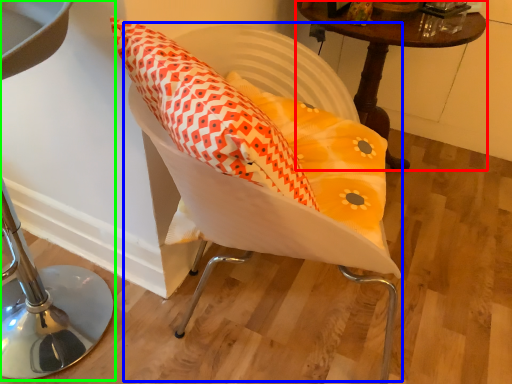
Question: Based on their relative distances, which object is farther from table (highlighted by a red box)? Choose from swivel chair (highlighted by a blue box) and furniture (highlighted by a green box).

Choices:
 (A) swivel chair
 (B) furniture

Answer: (B)